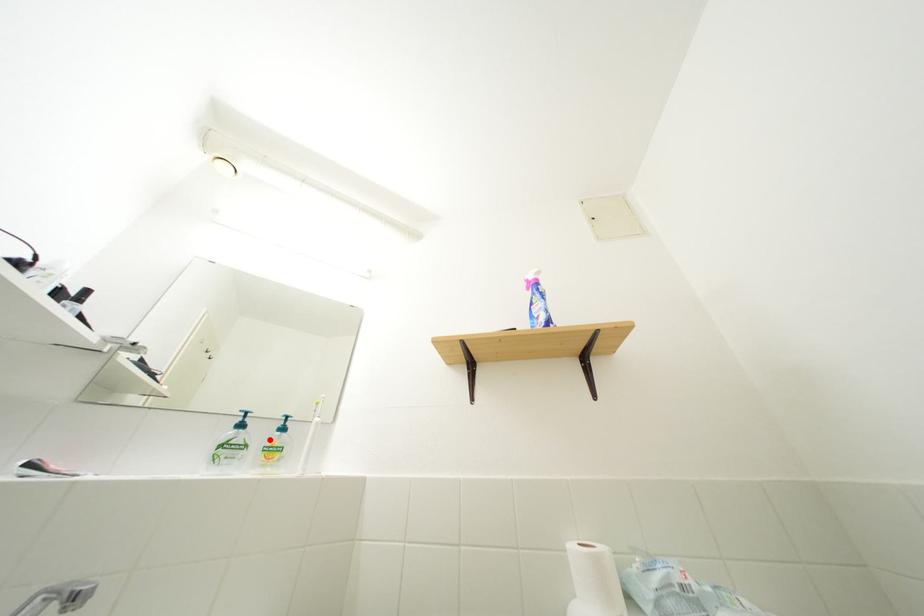
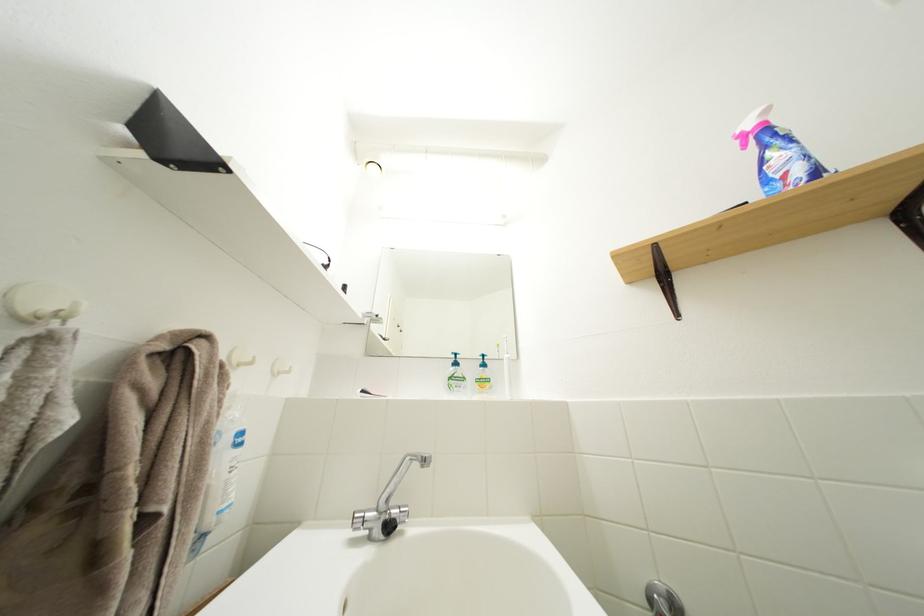
In the second image, find the point that corresponds to the highlighted location in the first image.

(479, 376)